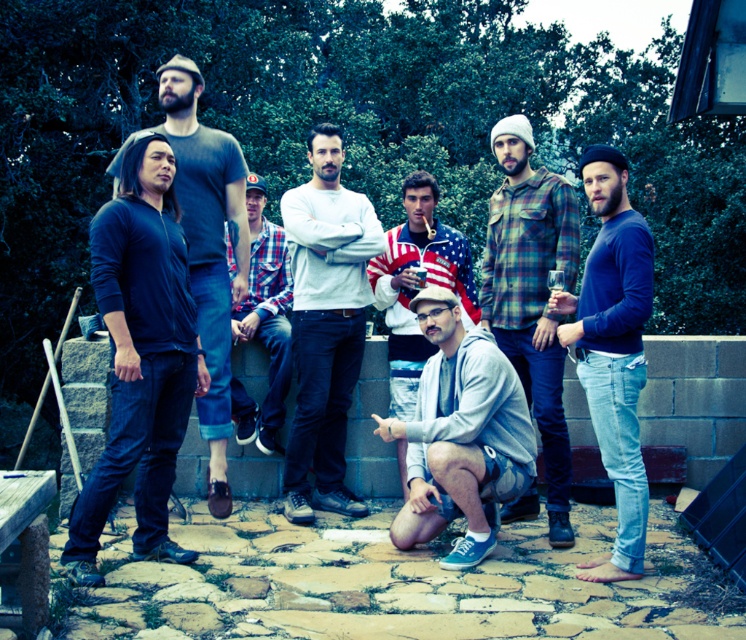
Question: Is dark blue sweater at left wider than dark gray t-shirt at left?

Choices:
 (A) yes
 (B) no

Answer: (A)

Question: Among these objects, which one is nearest to the camera?

Choices:
 (A) dark gray t-shirt at left
 (B) gray fleece jacket at center
 (C) blue cotton shirt at right

Answer: (C)

Question: Which point is farther from the camera taking this photo?

Choices:
 (A) (169, 240)
 (B) (219, 452)

Answer: (B)

Question: Which object appears farthest from the camera in this image?

Choices:
 (A) gray fleece jacket at center
 (B) gray cotton sweater at center

Answer: (B)

Question: Is the position of plaid flannel shirt at center more distant than that of plaid fabric shirt at center?

Choices:
 (A) no
 (B) yes

Answer: (A)

Question: Considering the relative positions of gray fleece jacket at center and blue cotton shirt at right in the image provided, where is gray fleece jacket at center located with respect to blue cotton shirt at right?

Choices:
 (A) right
 (B) left

Answer: (B)